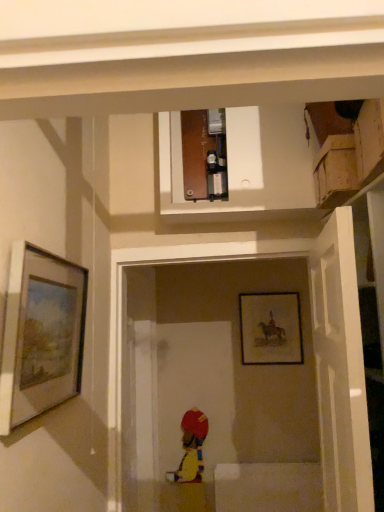
The width and height of the screenshot is (384, 512). What do you see at coordinates (340, 368) in the screenshot?
I see `white matte door at right` at bounding box center [340, 368].

Describe the element at coordinates (41, 334) in the screenshot. The width and height of the screenshot is (384, 512). I see `matte silver picture frame at left, the first picture frame in the front-to-back sequence` at that location.

Find the location of `matte black picture frame at center, marked as the 1th picture frame in a back-to-front arrangement`. matte black picture frame at center, marked as the 1th picture frame in a back-to-front arrangement is located at coordinates (270, 329).

Considering their positions, is white matte door at right located in front of or behind matte black picture frame at center, marked as the 1th picture frame in a back-to-front arrangement?

white matte door at right is in front of matte black picture frame at center, marked as the 1th picture frame in a back-to-front arrangement.

Is white matte door at right positioned far away from matte black picture frame at center, which appears as the second picture frame when viewed from the front?

Absolutely, white matte door at right is distant from matte black picture frame at center, which appears as the second picture frame when viewed from the front.

From a real-world perspective, between white matte door at right and matte black picture frame at center, the 1th picture frame from the right, who is vertically lower?

white matte door at right is physically lower.

Between point (323, 255) and point (255, 313), which one is positioned in front?

The point (323, 255) is in front.

Is matte silver picture frame at left, the first picture frame in the front-to-back sequence, not close to matte black picture frame at center, which is counted as the 2th picture frame, starting from the left?

That's right, there is a large distance between matte silver picture frame at left, the first picture frame in the front-to-back sequence, and matte black picture frame at center, which is counted as the 2th picture frame, starting from the left.

Which is correct: matte silver picture frame at left, the first picture frame in the front-to-back sequence, is inside matte black picture frame at center, the 1th picture frame from the right, or outside of it?

matte silver picture frame at left, the first picture frame in the front-to-back sequence, is spatially situated outside matte black picture frame at center, the 1th picture frame from the right.

Which of these two, white matte door at right or matte silver picture frame at left, the 2th picture frame in the right-to-left sequence, is wider?

white matte door at right is wider.

Looking at this image, is white matte door at right to the right of matte silver picture frame at left, the first picture frame in the front-to-back sequence, from the viewer's perspective?

Yes.

Does white matte door at right have a larger size compared to matte silver picture frame at left, placed as the first picture frame when sorted from left to right?

Yes, white matte door at right is bigger than matte silver picture frame at left, placed as the first picture frame when sorted from left to right.

Is matte black picture frame at center, which is counted as the 2th picture frame, starting from the left, aimed at matte silver picture frame at left, positioned as the second picture frame in back-to-front order?

Yes, matte black picture frame at center, which is counted as the 2th picture frame, starting from the left, faces towards matte silver picture frame at left, positioned as the second picture frame in back-to-front order.

The image size is (384, 512). In order to click on picture frame lying in front of the matte black picture frame at center, which is counted as the 2th picture frame, starting from the left in this screenshot , I will do `click(41, 334)`.

Considering the sizes of objects matte black picture frame at center, which appears as the second picture frame when viewed from the front, and matte silver picture frame at left, the 2th picture frame in the right-to-left sequence, in the image provided, who is shorter, matte black picture frame at center, which appears as the second picture frame when viewed from the front, or matte silver picture frame at left, the 2th picture frame in the right-to-left sequence,?

With less height is matte silver picture frame at left, the 2th picture frame in the right-to-left sequence.

Looking at this image, can you confirm if matte silver picture frame at left, positioned as the second picture frame in back-to-front order, is bigger than white matte door at right?

No, matte silver picture frame at left, positioned as the second picture frame in back-to-front order, is not bigger than white matte door at right.

Which object is closer to the camera, matte silver picture frame at left, the 2th picture frame in the right-to-left sequence, or white matte door at right?

white matte door at right is in front.

Would you consider matte silver picture frame at left, placed as the first picture frame when sorted from left to right, to be distant from white matte door at right?

matte silver picture frame at left, placed as the first picture frame when sorted from left to right, is near white matte door at right, not far away.

Identify the location of door that appears below the matte silver picture frame at left, the first picture frame in the front-to-back sequence (from the image's perspective). (340, 368).

The height and width of the screenshot is (512, 384). Find the location of `door to the left of matte black picture frame at center, which is counted as the 2th picture frame, starting from the left`. door to the left of matte black picture frame at center, which is counted as the 2th picture frame, starting from the left is located at coordinates [x=340, y=368].

Does matte black picture frame at center, marked as the 1th picture frame in a back-to-front arrangement, have a larger size compared to white matte door at right?

No, matte black picture frame at center, marked as the 1th picture frame in a back-to-front arrangement, is not bigger than white matte door at right.

Is matte black picture frame at center, which appears as the second picture frame when viewed from the front, to the left or to the right of white matte door at right in the image?

In the image, matte black picture frame at center, which appears as the second picture frame when viewed from the front, appears on the right side of white matte door at right.

From a real-world perspective, who is located lower, matte black picture frame at center, the 1th picture frame from the right, or white matte door at right?

white matte door at right is physically lower.

Locate an element on the screen. The height and width of the screenshot is (512, 384). door on the left of matte black picture frame at center, which appears as the second picture frame when viewed from the front is located at coordinates (340, 368).

I want to click on picture frame beneath the matte silver picture frame at left, placed as the first picture frame when sorted from left to right (from a real-world perspective), so click(270, 329).

Which object lies further to the anchor point matte silver picture frame at left, placed as the first picture frame when sorted from left to right, matte black picture frame at center, which appears as the second picture frame when viewed from the front, or white matte door at right?

matte black picture frame at center, which appears as the second picture frame when viewed from the front, is positioned further to the anchor matte silver picture frame at left, placed as the first picture frame when sorted from left to right.

Considering their positions, is matte black picture frame at center, which is counted as the 2th picture frame, starting from the left, positioned further to white matte door at right than matte silver picture frame at left, positioned as the second picture frame in back-to-front order?

The object further to white matte door at right is matte black picture frame at center, which is counted as the 2th picture frame, starting from the left.

Which object lies nearer to the anchor point white matte door at right, matte silver picture frame at left, the first picture frame in the front-to-back sequence, or matte black picture frame at center, which appears as the second picture frame when viewed from the front?

matte silver picture frame at left, the first picture frame in the front-to-back sequence.

Based on their spatial positions, is matte silver picture frame at left, the 2th picture frame in the right-to-left sequence, or white matte door at right further from matte black picture frame at center, the 1th picture frame from the right?

Among the two, matte silver picture frame at left, the 2th picture frame in the right-to-left sequence, is located further to matte black picture frame at center, the 1th picture frame from the right.

Consider the image. Estimate the real-world distances between objects in this image. Which object is closer to matte black picture frame at center, the 1th picture frame from the right, white matte door at right or matte silver picture frame at left, placed as the first picture frame when sorted from left to right?

Among the two, white matte door at right is located nearer to matte black picture frame at center, the 1th picture frame from the right.

Considering their positions, is white matte door at right positioned further to matte silver picture frame at left, the 2th picture frame in the right-to-left sequence, than matte black picture frame at center, which appears as the second picture frame when viewed from the front?

Based on the image, matte black picture frame at center, which appears as the second picture frame when viewed from the front, appears to be further to matte silver picture frame at left, the 2th picture frame in the right-to-left sequence.

This screenshot has height=512, width=384. What are the coordinates of `picture frame between white matte door at right and matte black picture frame at center, marked as the 1th picture frame in a back-to-front arrangement, from front to back` in the screenshot? It's located at (41, 334).